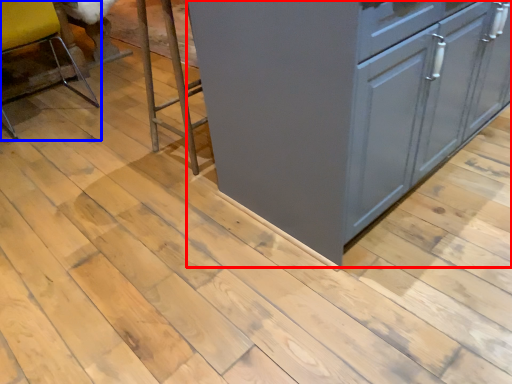
Question: Which object appears farthest to the camera in this image, cabinetry (highlighted by a red box) or chair (highlighted by a blue box)?

Choices:
 (A) cabinetry
 (B) chair

Answer: (B)